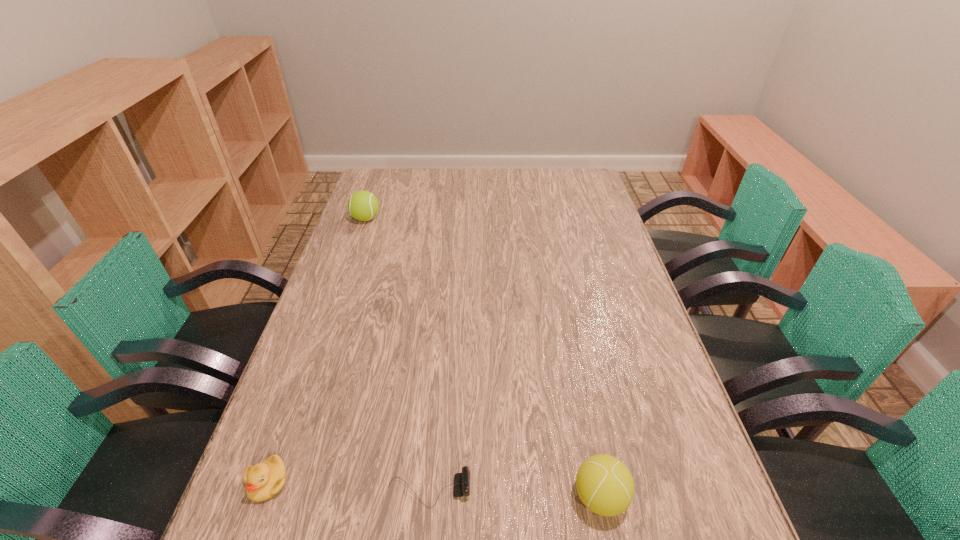
The height and width of the screenshot is (540, 960). Identify the location of tennis ball present at the left edge. pos(363,205).

Identify the location of duckling located at the left edge. The image size is (960, 540). (263, 481).

Locate an element on the screen. free space at the left edge of the desktop is located at coordinates [381, 236].

The height and width of the screenshot is (540, 960). What are the coordinates of `blank area at the right edge` in the screenshot? It's located at (x=576, y=239).

You are a GUI agent. You are given a task and a screenshot of the screen. Output one action in this format:
    pyautogui.click(x=<x>, y=<y>)
    Task: Click on the vacant area that lies between the farthest object and the webcam
    The width and height of the screenshot is (960, 540).
    Given the screenshot: What is the action you would take?
    pyautogui.click(x=397, y=354)

At what (x,y) coordinates should I click in order to perform the action: click on vacant area that lies between the farthest object and the webcam. Please return your answer as a coordinate pair (x, y). Looking at the image, I should click on (397, 354).

You are a GUI agent. You are given a task and a screenshot of the screen. Output one action in this format:
    pyautogui.click(x=<x>, y=<y>)
    Task: Click on the free space between the second shortest object and the shortest object
    The image size is (960, 540).
    Given the screenshot: What is the action you would take?
    pyautogui.click(x=348, y=486)

Where is `vacant space that's between the nearer tennis ball and the shortest object`? Image resolution: width=960 pixels, height=540 pixels. vacant space that's between the nearer tennis ball and the shortest object is located at coordinates (515, 494).

Identify the location of free space between the nearer tennis ball and the second shortest object. (434, 489).

The height and width of the screenshot is (540, 960). I want to click on vacant space in between the farther tennis ball and the third tallest object, so click(317, 350).